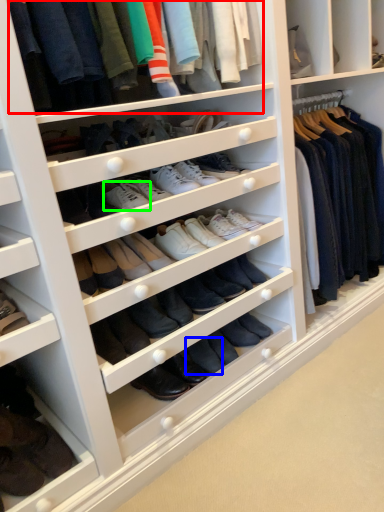
Question: Which is farther away from clothing (highlighted by a red box)? shoe (highlighted by a blue box) or shoe (highlighted by a green box)?

Choices:
 (A) shoe
 (B) shoe

Answer: (A)